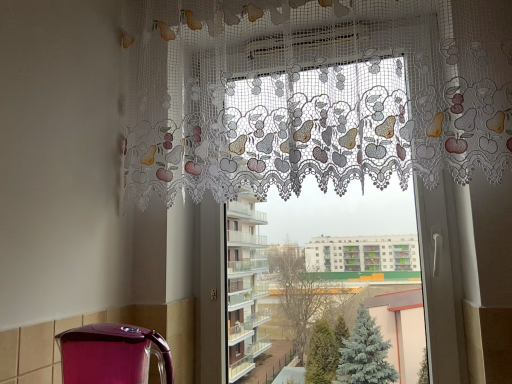
Question: Considering the relative positions of lace fabric curtain at upper center and white lace curtain at upper center in the image provided, is lace fabric curtain at upper center in front of white lace curtain at upper center?

Choices:
 (A) no
 (B) yes

Answer: (B)

Question: Does lace fabric curtain at upper center turn towards white lace curtain at upper center?

Choices:
 (A) yes
 (B) no

Answer: (B)

Question: Is lace fabric curtain at upper center positioned with its back to white lace curtain at upper center?

Choices:
 (A) no
 (B) yes

Answer: (B)

Question: Is lace fabric curtain at upper center shorter than white lace curtain at upper center?

Choices:
 (A) yes
 (B) no

Answer: (A)

Question: From a real-world perspective, is lace fabric curtain at upper center located higher than white lace curtain at upper center?

Choices:
 (A) yes
 (B) no

Answer: (A)

Question: Is lace fabric curtain at upper center positioned behind white lace curtain at upper center?

Choices:
 (A) yes
 (B) no

Answer: (B)

Question: Is white lace curtain at upper center behind shiny purple kettle at lower left?

Choices:
 (A) no
 (B) yes

Answer: (B)

Question: Is white lace curtain at upper center at the left side of shiny purple kettle at lower left?

Choices:
 (A) yes
 (B) no

Answer: (B)

Question: Can you confirm if white lace curtain at upper center is shorter than shiny purple kettle at lower left?

Choices:
 (A) no
 (B) yes

Answer: (A)

Question: Is white lace curtain at upper center not near shiny purple kettle at lower left?

Choices:
 (A) no
 (B) yes

Answer: (A)

Question: Is white lace curtain at upper center next to shiny purple kettle at lower left?

Choices:
 (A) no
 (B) yes

Answer: (A)

Question: Does white lace curtain at upper center have a lesser width compared to shiny purple kettle at lower left?

Choices:
 (A) yes
 (B) no

Answer: (A)

Question: From a real-world perspective, is lace fabric curtain at upper center over shiny purple kettle at lower left?

Choices:
 (A) no
 (B) yes

Answer: (B)